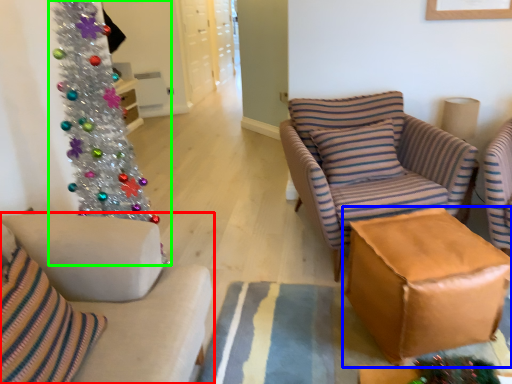
Question: Which object is positioned closest to studio couch (highlighted by a red box)? Select from table (highlighted by a blue box) and christmas tree (highlighted by a green box).

Choices:
 (A) table
 (B) christmas tree

Answer: (B)